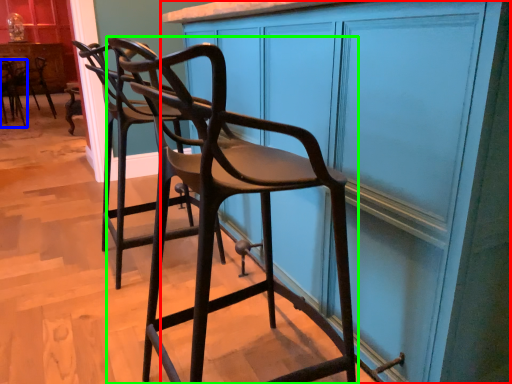
Question: Considering the real-world distances, which object is closest to cabinetry (highlighted by a red box)? chair (highlighted by a blue box) or chair (highlighted by a green box).

Choices:
 (A) chair
 (B) chair

Answer: (B)